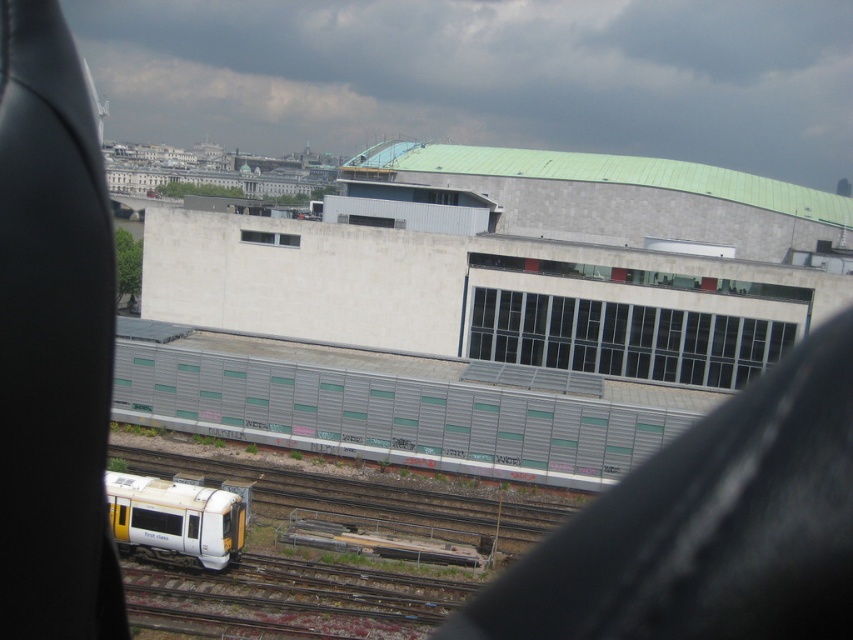
Question: Which object appears farthest from the camera in this image?

Choices:
 (A) metallic gray train at center
 (B) transparent glass window at center
 (C) white glossy passenger train at lower left

Answer: (B)

Question: Is transparent glass windows at center positioned behind transparent glass window at center?

Choices:
 (A) no
 (B) yes

Answer: (A)

Question: From the image, what is the correct spatial relationship of metallic gray train at center in relation to transparent glass windows at center?

Choices:
 (A) left
 (B) right

Answer: (A)

Question: Is metallic gray train at center smaller than transparent glass windows at center?

Choices:
 (A) no
 (B) yes

Answer: (A)

Question: Based on their relative distances, which object is farther from the metallic gray train at center?

Choices:
 (A) transparent glass window at center
 (B) transparent glass windows at center

Answer: (A)

Question: Among these points, which one is nearest to the camera?

Choices:
 (A) (549, 316)
 (B) (276, 232)
 (C) (233, 534)

Answer: (C)